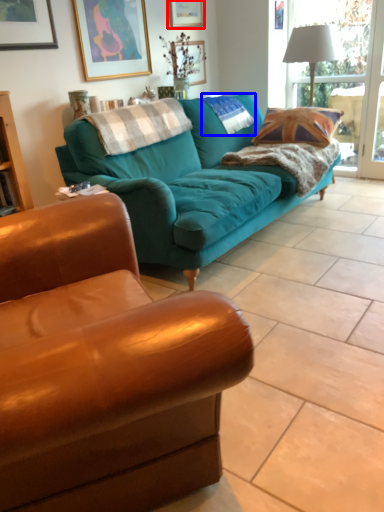
Question: Which of the following is the closest to the observer, picture frame (highlighted by a red box) or pillow (highlighted by a blue box)?

Choices:
 (A) picture frame
 (B) pillow

Answer: (B)